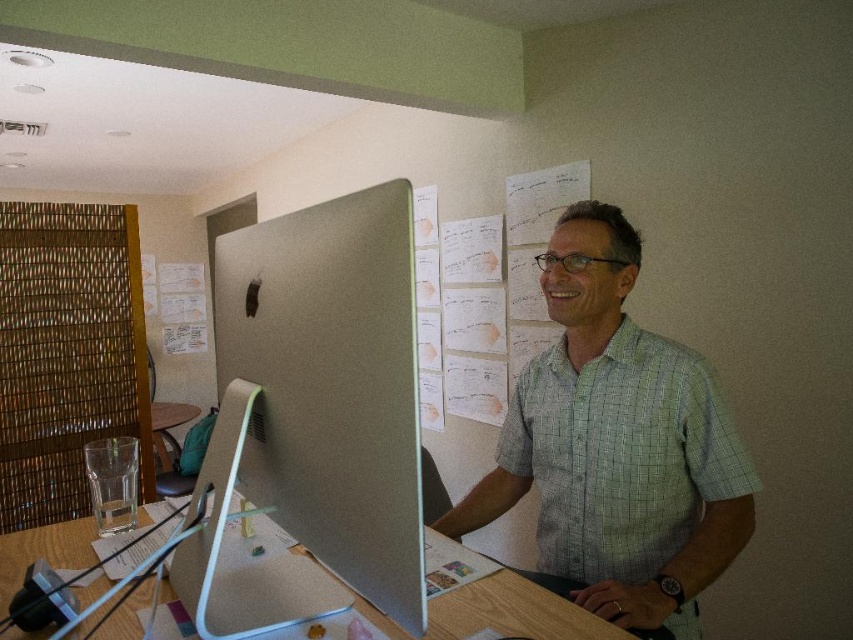
Question: Among these objects, which one is farthest from the camera?

Choices:
 (A) sleek silver monitor at center
 (B) green checkered shirt at center
 (C) woven bamboo at left
 (D) brown wooden table at center

Answer: (D)

Question: Can you confirm if wooden desk at center is positioned above sleek silver monitor at center?

Choices:
 (A) yes
 (B) no

Answer: (B)

Question: Which object is the farthest from the brown wooden table at center?

Choices:
 (A) sleek silver monitor at center
 (B) woven bamboo at left
 (C) wooden desk at center

Answer: (A)

Question: Does green checkered shirt at center have a lesser width compared to woven bamboo at left?

Choices:
 (A) no
 (B) yes

Answer: (A)

Question: Based on their relative distances, which object is farther from the brown wooden table at center?

Choices:
 (A) woven bamboo at left
 (B) wooden desk at center
 (C) green checkered shirt at center

Answer: (B)

Question: Does woven bamboo at left appear over brown wooden table at center?

Choices:
 (A) no
 (B) yes

Answer: (B)